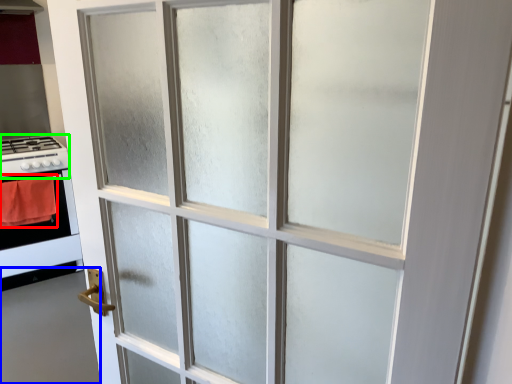
Question: Which object is the farthest from blanket (highlighted by a red box)? Choose among these: door (highlighted by a blue box) or gas stove (highlighted by a green box).

Choices:
 (A) door
 (B) gas stove

Answer: (A)